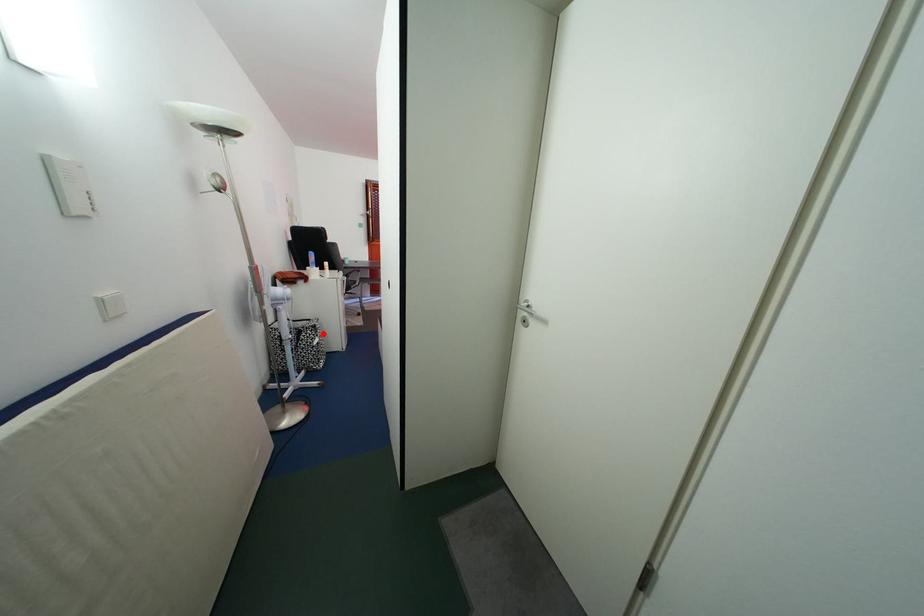
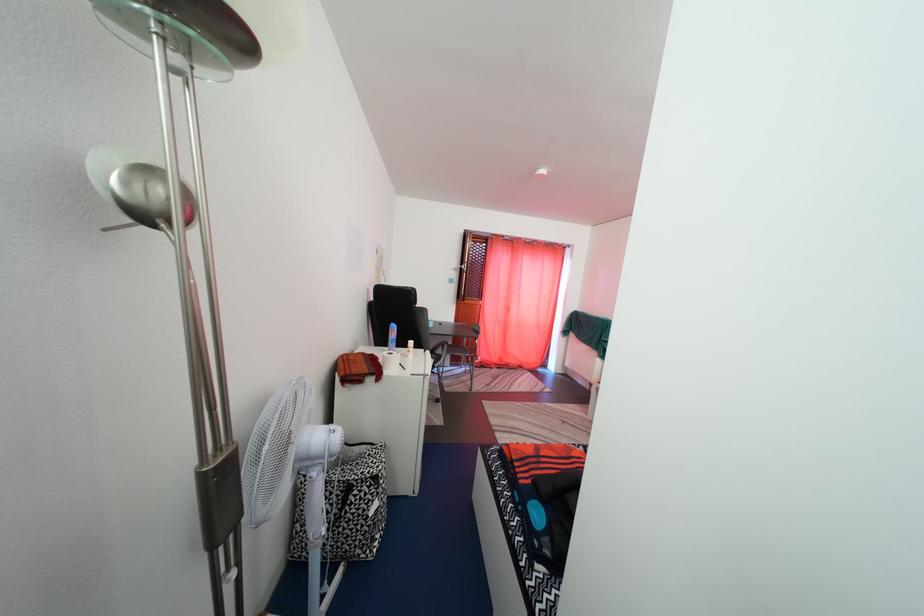
Find the pixel in the second image that matches the highlighted location in the first image.

(384, 485)